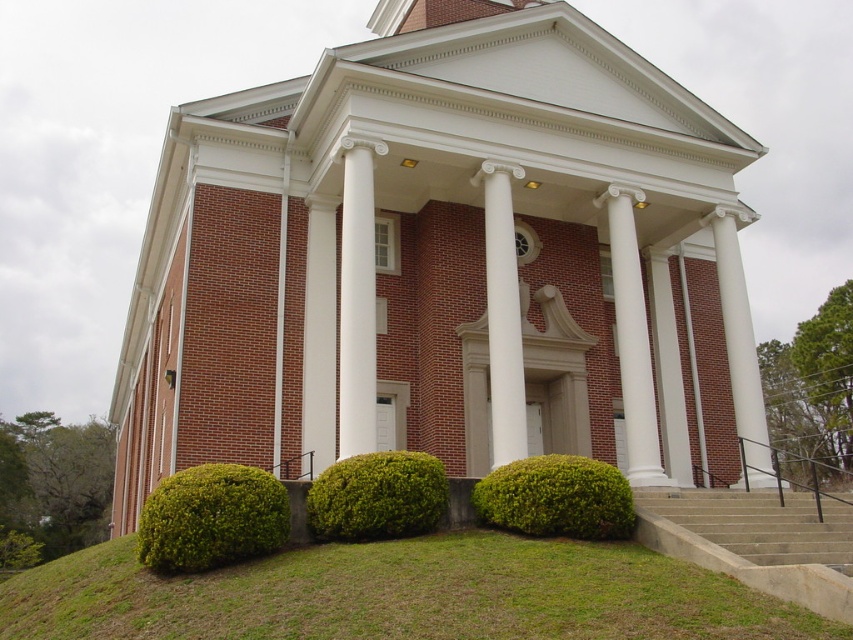
You are standing in front of the classical building and want to place a decorative pot between the green leafy bush at lower center and the white marble column at center. Which object should the pot be placed closer to if you want it to be closer to you?

The pot should be placed closer to the green leafy bush at lower center because it is closer to the viewer than the white marble column at center.

You are a landscape architect designing a garden around the classical building. You need to place a new statue that is 2 meters tall. Considering the green leafy bush at lower center and the white marble column at center, which object would be more suitable as a reference point for the statue placement to ensure proper scale?

The white marble column at center is taller than the green leafy bush at lower center, so placing the statue next to the white marble column at center would provide a better reference for scale since the column is taller and can better accommodate the statue height.

You are a gardener who needs to mow the lawn. You see the green grass at lower center and the green leafy hedge at lower center. Which one should you mow first based on their height?

The green grass at lower center is taller than the green leafy hedge at lower center, so you should mow the green grass at lower center first.